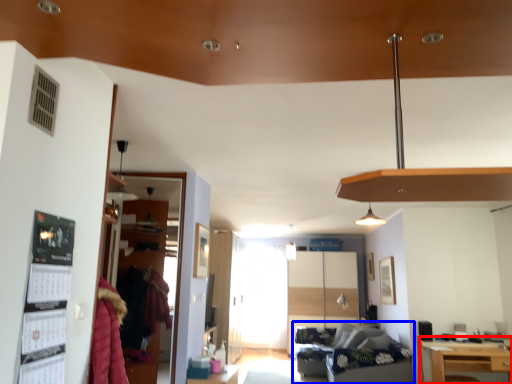
Question: Which object appears closest to the camera in this image, table (highlighted by a red box) or studio couch (highlighted by a blue box)?

Choices:
 (A) table
 (B) studio couch

Answer: (A)